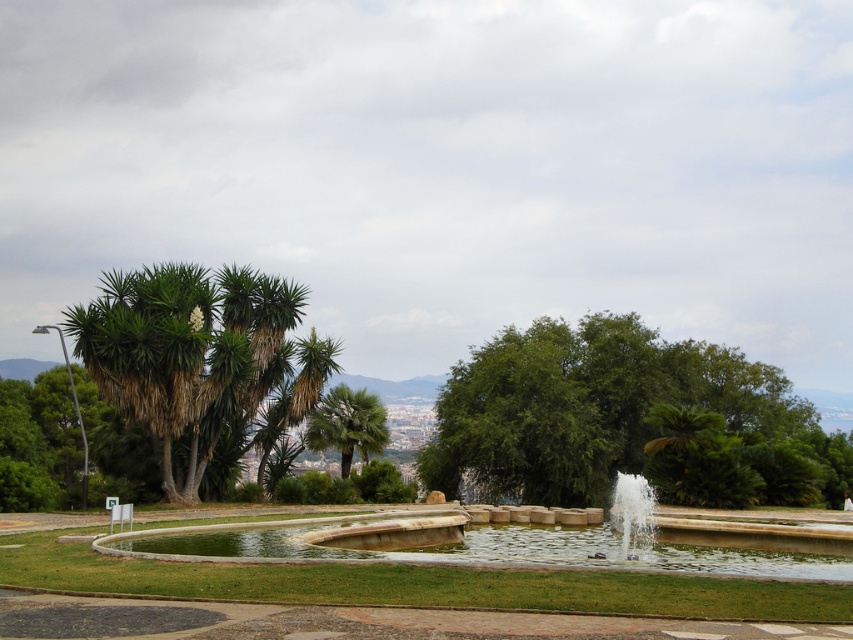
Question: Does green leafy tree at center lie behind green leafy palm tree at center?

Choices:
 (A) no
 (B) yes

Answer: (A)

Question: Is green leafy trees at left bigger than green leafy palm tree at center?

Choices:
 (A) no
 (B) yes

Answer: (B)

Question: Can you confirm if green leafy trees at left is positioned below green leafy palm tree at center?

Choices:
 (A) yes
 (B) no

Answer: (B)

Question: Which point is closer to the camera?

Choices:
 (A) (370, 442)
 (B) (637, 492)

Answer: (B)

Question: Among these objects, which one is nearest to the camera?

Choices:
 (A) green leafy tree at center
 (B) green leafy palm tree at center

Answer: (A)

Question: Which point is farther from the camera taking this photo?

Choices:
 (A) (621, 524)
 (B) (347, 436)
 (C) (801, 429)
 (D) (192, 308)

Answer: (C)